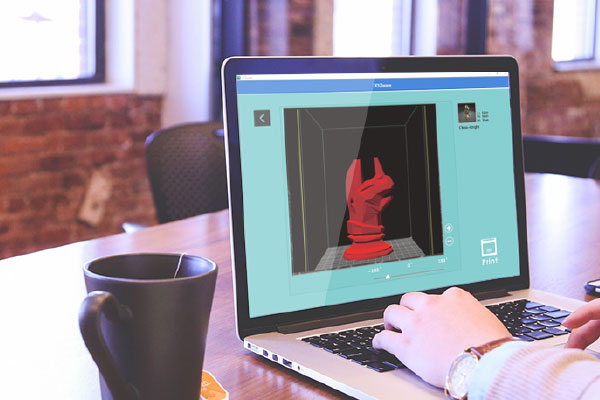
The height and width of the screenshot is (400, 600). I want to click on mug, so click(x=151, y=329).